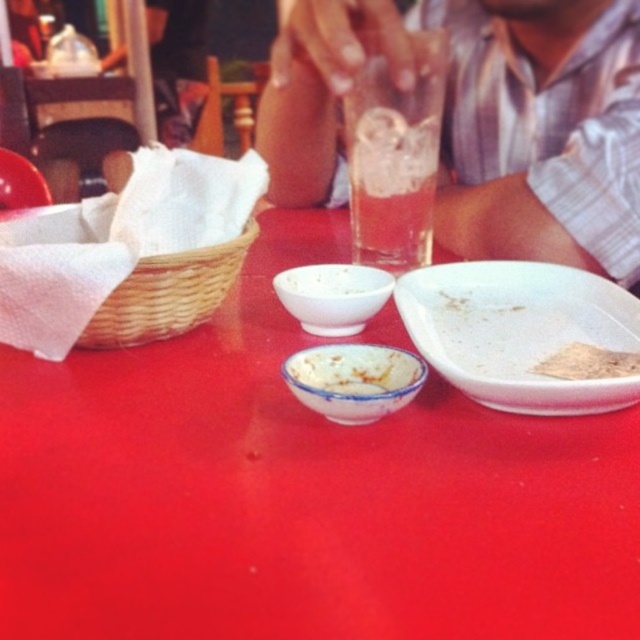
Question: Is clear glass at upper center smaller than translucent glass beverage at center?

Choices:
 (A) no
 (B) yes

Answer: (A)

Question: From the image, what is the correct spatial relationship of translucent glass beverage at center in relation to white powder at center?

Choices:
 (A) left
 (B) right

Answer: (A)

Question: Which point is farther to the camera?

Choices:
 (A) white ceramic bowl at center
 (B) white powder at center

Answer: (B)

Question: In this image, where is white ceramic bowl at center located relative to white powder at center?

Choices:
 (A) right
 (B) left

Answer: (B)

Question: Which point is farther to the camera?

Choices:
 (A) white ceramic bowl at center
 (B) matte white bowl at left
 (C) clear glass at upper center
 (D) white powder at center

Answer: (B)

Question: Which point is farther from the camera taking this photo?

Choices:
 (A) (387, 90)
 (B) (566, 356)
 (C) (108, 525)
 (D) (342, 273)

Answer: (A)